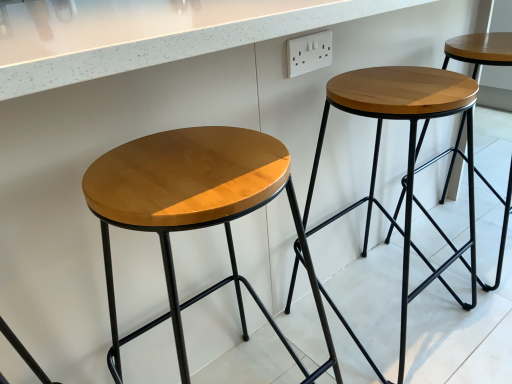
Find the location of a particular element. vacant space in front of white plastic outlet at upper center is located at coordinates (371, 91).